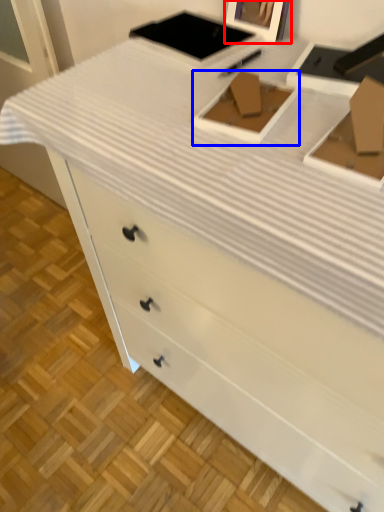
Question: Which object appears closest to the camera in this image, picture frame (highlighted by a red box) or box (highlighted by a blue box)?

Choices:
 (A) picture frame
 (B) box

Answer: (B)